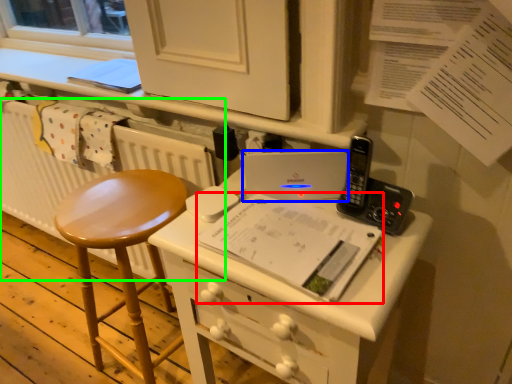
Question: Considering the real-world distances, which object is farthest from book (highlighted by a red box)? laptop (highlighted by a blue box) or radiator (highlighted by a green box)?

Choices:
 (A) laptop
 (B) radiator

Answer: (B)